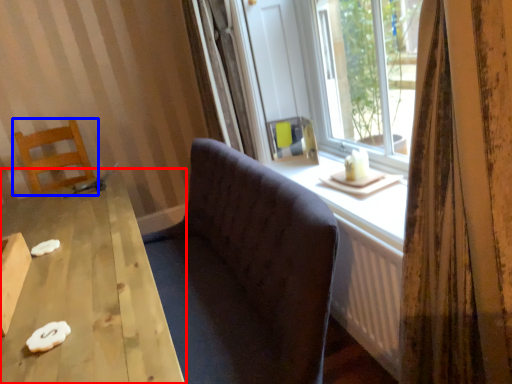
Question: Which object appears farthest to the camera in this image, table (highlighted by a red box) or chair (highlighted by a blue box)?

Choices:
 (A) table
 (B) chair

Answer: (B)